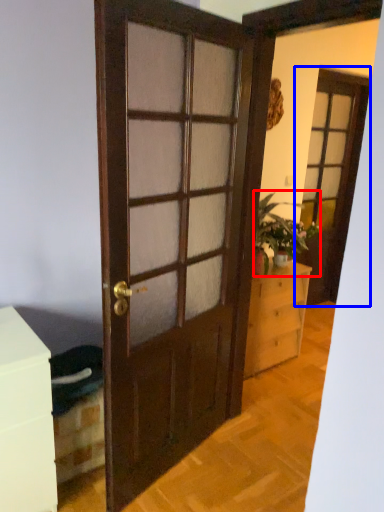
Question: Which object appears closest to the camera in this image, houseplant (highlighted by a red box) or screen door (highlighted by a blue box)?

Choices:
 (A) houseplant
 (B) screen door

Answer: (A)